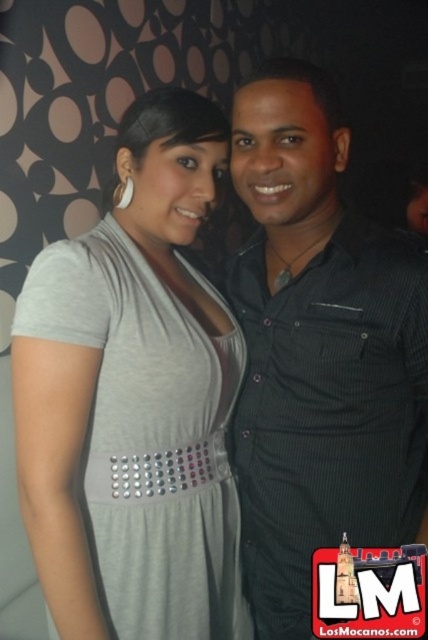
You are standing in front of the photograph and want to determine which of the two points, point (359, 417) or point (234, 518), is nearer to you. Based on the scene description, which point is closer?

Point (359, 417) is closer to the viewer than point (234, 518).

You are a photographer trying to place a small sticker on the image. The sticker is 0.05 units wide. You want to place it so that it covers the point at coordinates point [318,352]. Will the sticker fit entirely within the black textured shirt at center?

The point [318,352] is on black textured shirt at center. Since the sticker is 0.05 units wide, it will fit entirely within the black textured shirt at center as long as there is enough space around the point within the shirt. However, without knowing the exact dimensions of the shirt, we can only confirm the sticker is placed on the shirt, not its full coverage.

You are a photographer setting up for a portrait. You need to ensure that both the black textured shirt at center and the gray matte dress at center are fully visible in the frame. Based on their positions and sizes, do you think the current camera angle can capture both subjects without cropping either of them?

The black textured shirt at center might be wider than the gray matte dress at center, so the camera angle should be adjusted to accommodate the wider black textured shirt at center to ensure both are fully visible.